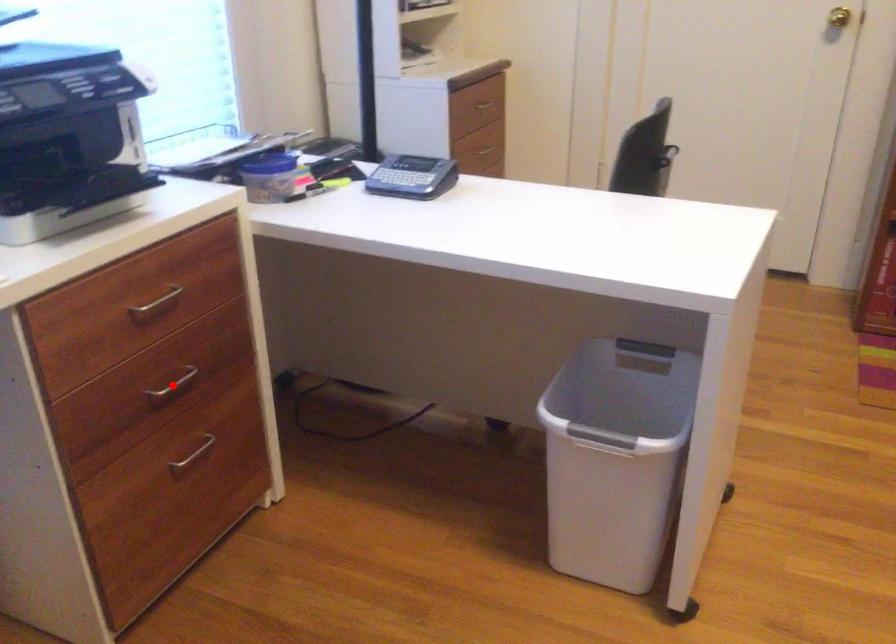
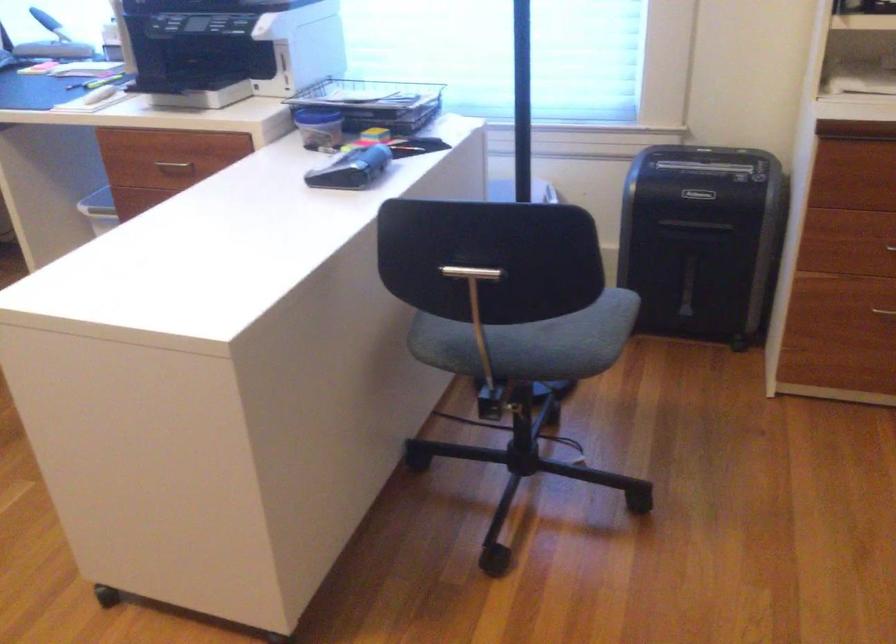
Question: I am providing you with two images of the same scene from different viewpoints. A red point is marked on the first image. At the location where the point appears in image 1, is it still visible in image 2?

Choices:
 (A) Yes
 (B) No

Answer: (B)